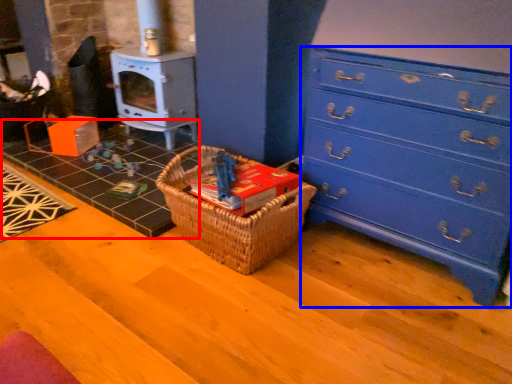
Question: Which object is further to the camera taking this photo, tile (highlighted by a red box) or chest of drawers (highlighted by a blue box)?

Choices:
 (A) tile
 (B) chest of drawers

Answer: (A)